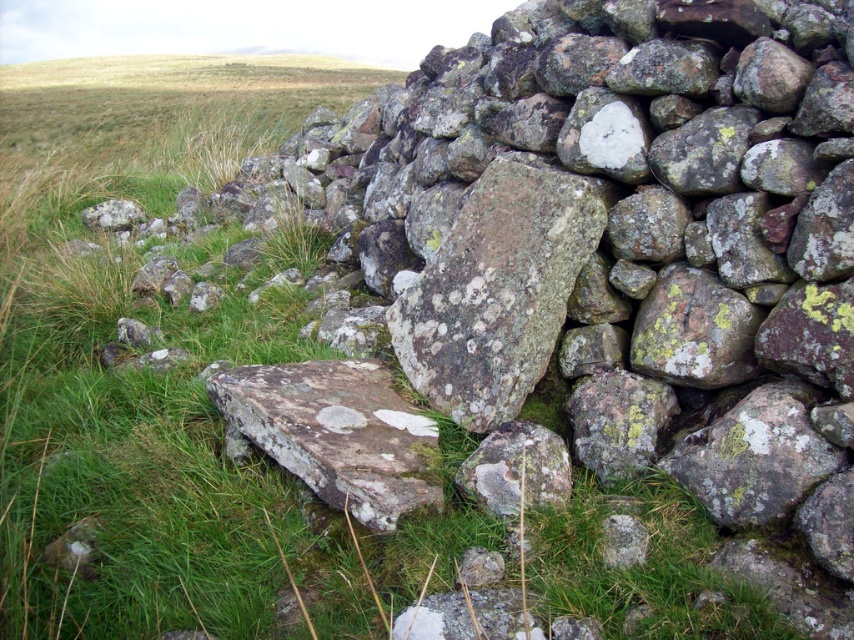
Question: Can you confirm if rusty brown rock at center is positioned below speckled rock at lower center?

Choices:
 (A) yes
 (B) no

Answer: (B)

Question: Does speckled rock at center appear under rusty brown rock at center?

Choices:
 (A) no
 (B) yes

Answer: (A)

Question: Which object is positioned farthest from the rusty brown rock at center?

Choices:
 (A) speckled rock at center
 (B) speckled rock at lower center

Answer: (A)

Question: Can you confirm if speckled rock at center is positioned to the left of speckled rock at lower center?

Choices:
 (A) no
 (B) yes

Answer: (B)

Question: Which of the following is the closest to the observer?

Choices:
 (A) speckled rock at center
 (B) rusty brown rock at center

Answer: (B)

Question: Which point appears closest to the camera in this image?

Choices:
 (A) (578, 256)
 (B) (303, 408)

Answer: (B)